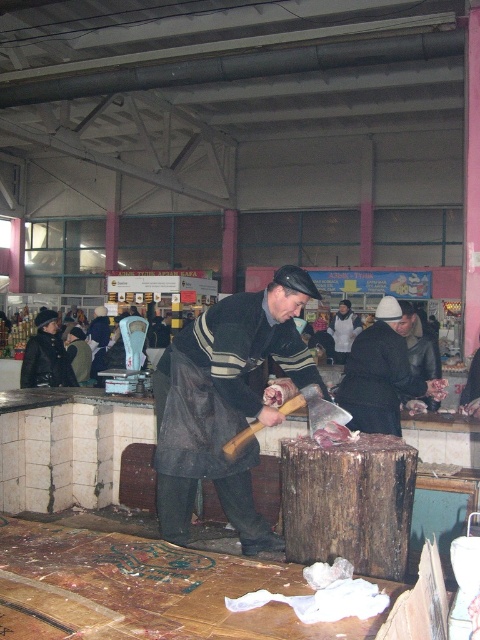
Question: Which point is farther to the camera?

Choices:
 (A) pinkish meat at center
 (B) meat raw at center
 (C) dark gray woolen coat at center

Answer: (B)

Question: Which object is the farthest from the pinkish meat at center?

Choices:
 (A) dark gray woolen coat at center
 (B) meat raw at center

Answer: (B)

Question: Which is nearer to the meat raw at center?

Choices:
 (A) pinkish meat at center
 (B) dark gray woolen coat at center

Answer: (A)

Question: Can you confirm if pinkish meat at center is positioned above meat raw at center?

Choices:
 (A) no
 (B) yes

Answer: (A)

Question: Can you confirm if pinkish meat at center is positioned to the right of meat raw at center?

Choices:
 (A) yes
 (B) no

Answer: (B)

Question: Does pinkish meat at center have a greater width compared to meat raw at center?

Choices:
 (A) no
 (B) yes

Answer: (B)